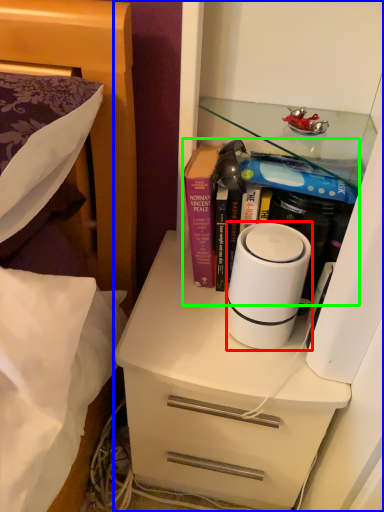
Question: Considering the real-world distances, which object is farthest from home appliance (highlighted by a red box)? cabinetry (highlighted by a blue box) or book (highlighted by a green box)?

Choices:
 (A) cabinetry
 (B) book

Answer: (A)